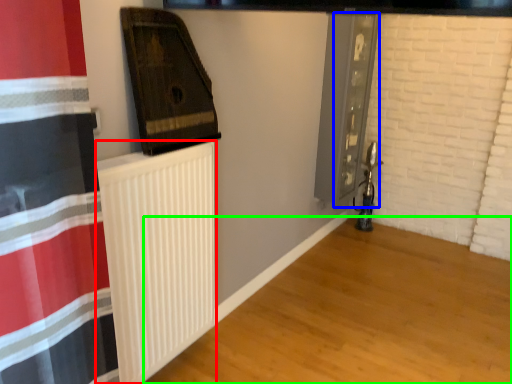
Question: Which object is positioned farthest from radiator (highlighted by a red box)? Select from screen door (highlighted by a blue box) and wood (highlighted by a green box).

Choices:
 (A) screen door
 (B) wood

Answer: (A)